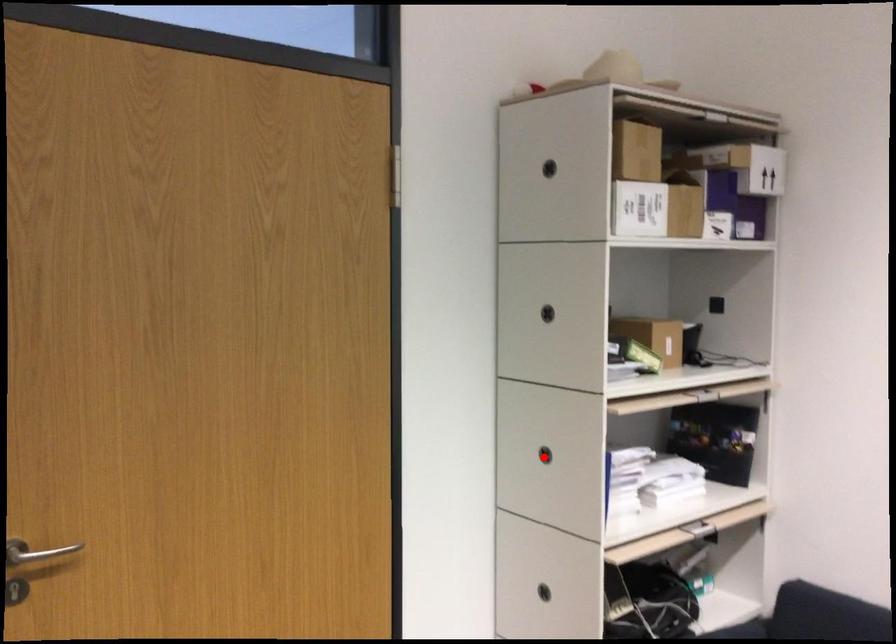
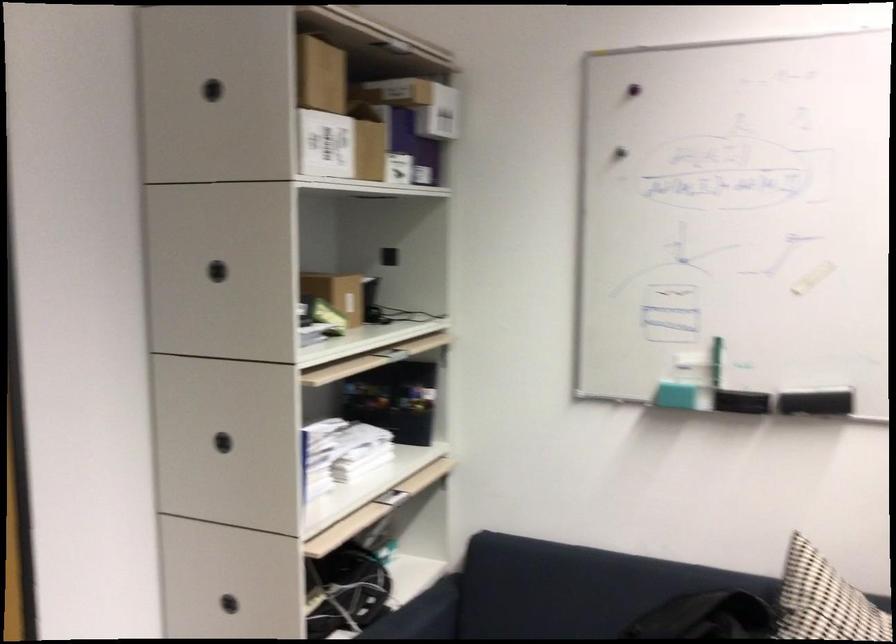
In the second image, find the point that corresponds to the highlighted location in the first image.

(222, 442)